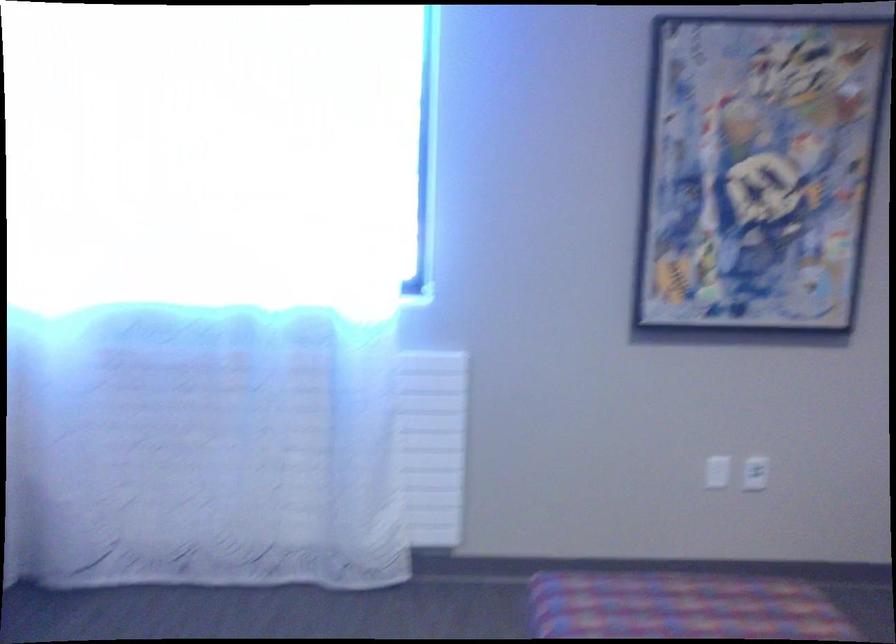
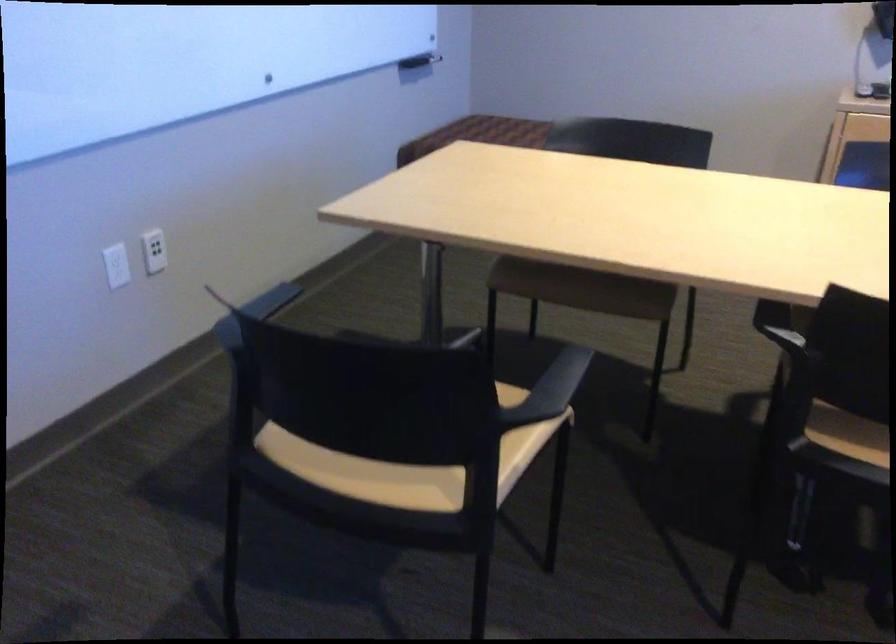
Based on the continuous images, in which direction is the camera rotating?

The camera's rotation is toward left-down.